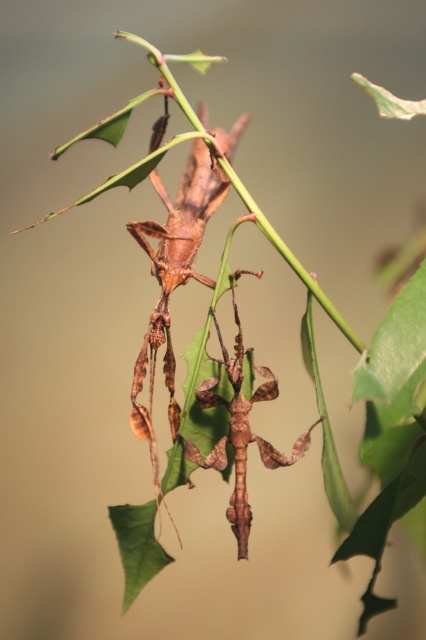
You are a photographer trying to capture a closeup of the stick insects on the branch. You notice two points of interest marked as point 1 at coordinates point (166, 282) and point 2 at coordinates point (247, 420). Which point should you focus on to ensure the closest insect is in sharp focus?

Point (166, 282) is closer to the camera than point (247, 420), so focusing on point (166, 282) will ensure the closest insect is in sharp focus.